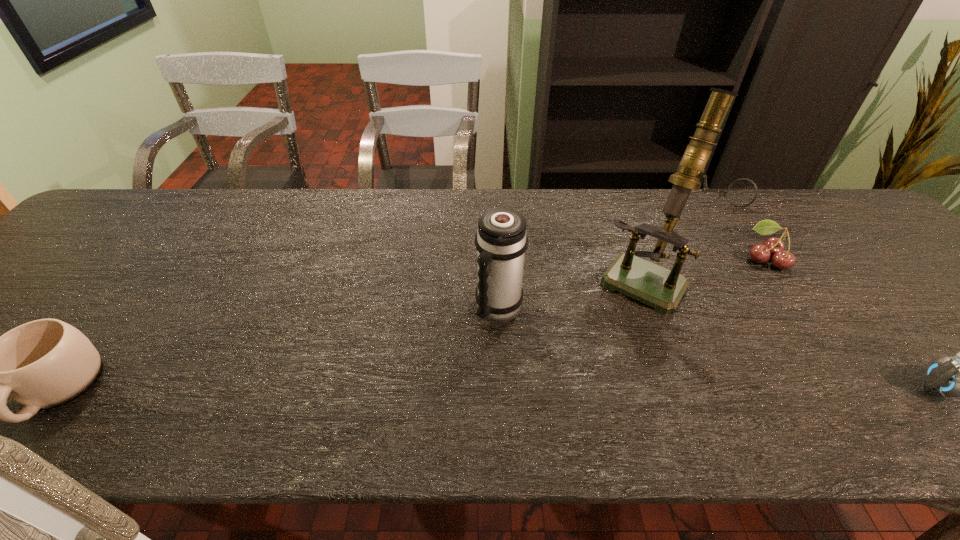
Identify the location of free space on the desktop that is between the mug and the headset and is positioned at the eyepiece of the microscope. Image resolution: width=960 pixels, height=540 pixels. (575, 389).

At what (x,y) coordinates should I click in order to perform the action: click on vacant spot on the desktop that is between the leftmost object and the third tallest object and is positioned on the leaves of the fourth object from left to right. Please return your answer as a coordinate pair (x, y). Looking at the image, I should click on (551, 389).

Image resolution: width=960 pixels, height=540 pixels. Identify the location of vacant space on the desktop that is between the leftmost object and the headset and is positioned on the side with the handle of the fourth object from right to left. [458, 389].